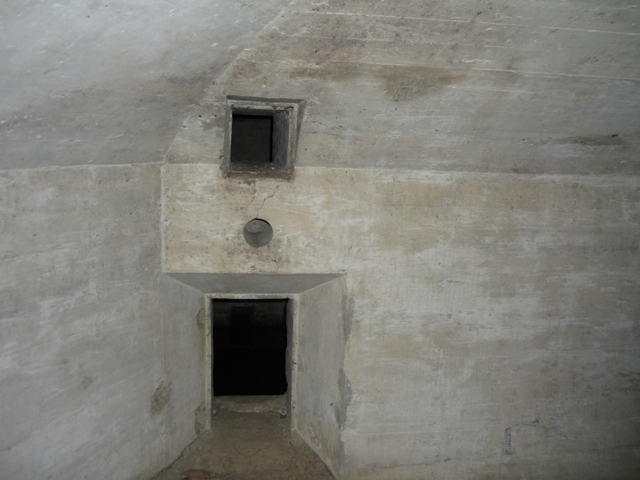
Find the location of a particular element. The height and width of the screenshot is (480, 640). seam where the wall meets the ceiling overhead is located at coordinates (418, 168), (68, 168), (320, 285), (187, 282).